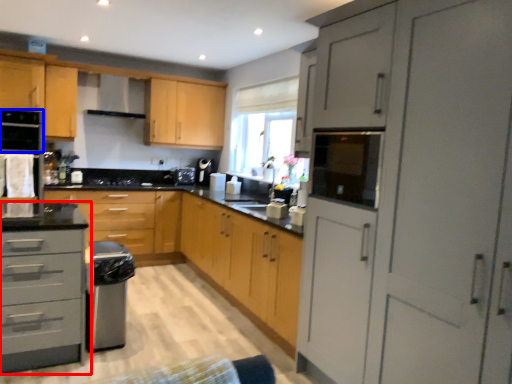
Question: Which point is closer to the camera, cabinetry (highlighted by a red box) or appliance (highlighted by a blue box)?

Choices:
 (A) cabinetry
 (B) appliance

Answer: (A)